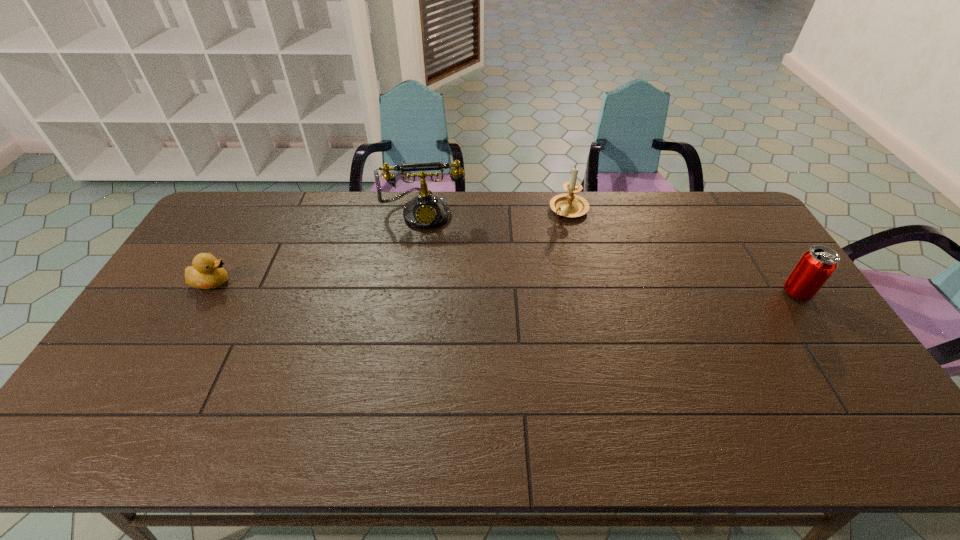
Locate an element on the screen. Image resolution: width=960 pixels, height=540 pixels. free space that is in between the soda can and the tallest object is located at coordinates (611, 252).

What are the coordinates of `empty location between the shortest object and the telephone` in the screenshot? It's located at (319, 247).

The height and width of the screenshot is (540, 960). I want to click on free point between the soda can and the leftmost object, so click(505, 287).

Locate which object ranks second in proximity to the soda can. Please provide its 2D coordinates. Your answer should be formatted as a tuple, i.e. [(x, y)], where the tuple contains the x and y coordinates of a point satisfying the conditions above.

[(425, 211)]

The width and height of the screenshot is (960, 540). Find the location of `object that stands as the second closest to the rightmost object`. object that stands as the second closest to the rightmost object is located at coordinates (425, 211).

In order to click on vacant region that satisfies the following two spatial constraints: 1. on the front side of the tallest object; 2. on the right side of the soda can in this screenshot , I will do `click(413, 293)`.

Locate an element on the screen. The height and width of the screenshot is (540, 960). free space that satisfies the following two spatial constraints: 1. on the front side of the soda can; 2. on the left side of the candle holder is located at coordinates (588, 293).

This screenshot has width=960, height=540. What are the coordinates of `blank space that satisfies the following two spatial constraints: 1. on the front side of the candle holder; 2. on the left side of the soda can` in the screenshot? It's located at (588, 293).